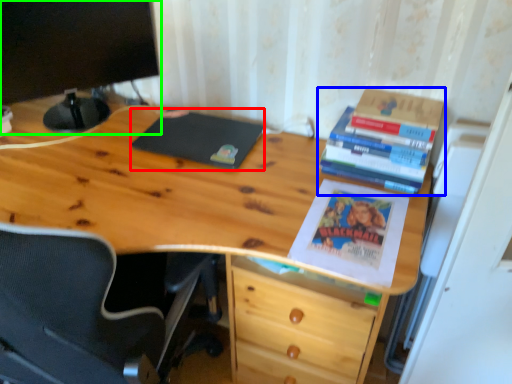
Question: Estimate the real-world distances between objects in this image. Which object is closer to notebook (highlighted by a red box), book (highlighted by a blue box) or computer monitor (highlighted by a green box)?

Choices:
 (A) book
 (B) computer monitor

Answer: (B)